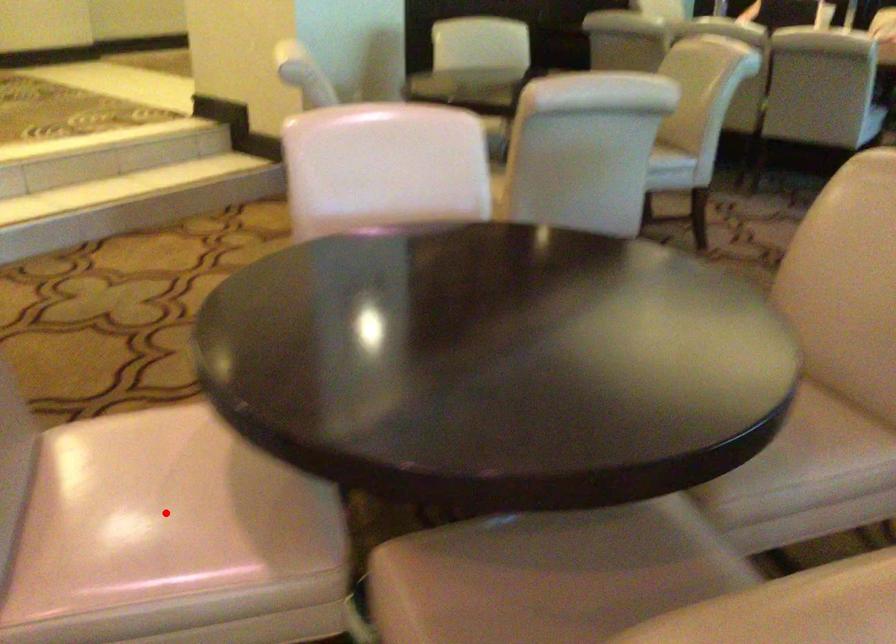
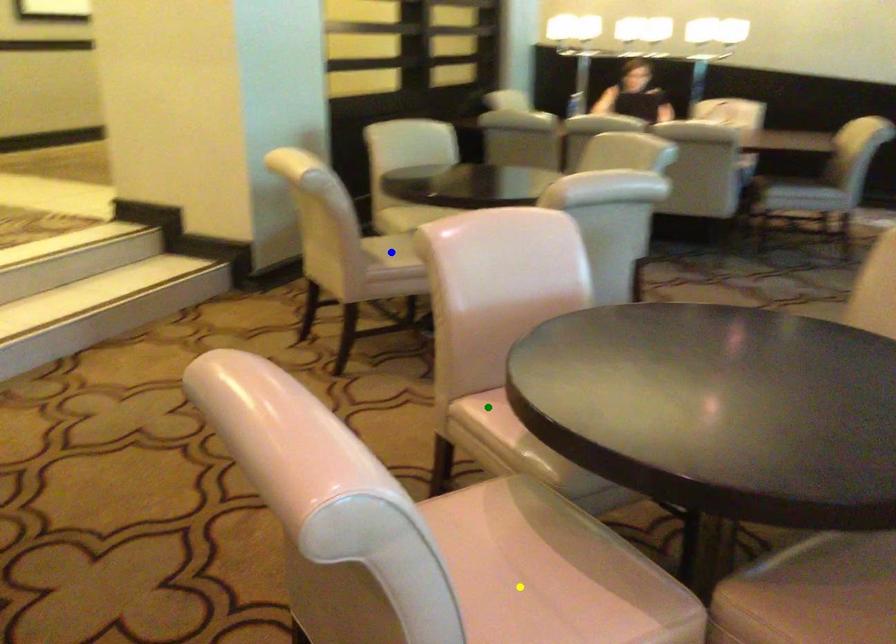
Question: I am providing you with two images of the same scene from different viewpoints. A red point is marked on the first image. You are given multiple points on the second image. Which mark in image 2 goes with the point in image 1?

Choices:
 (A) blue point
 (B) yellow point
 (C) green point

Answer: (B)